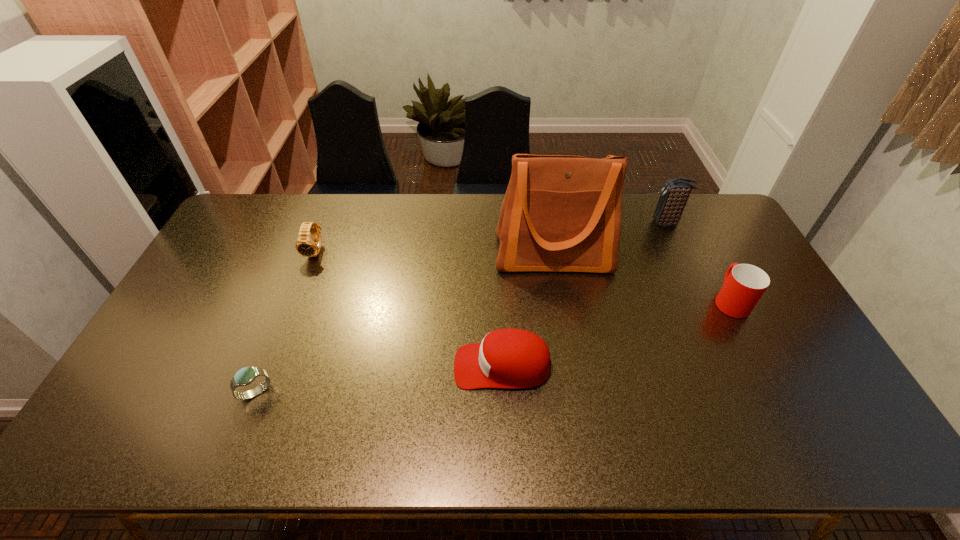
The image size is (960, 540). In order to click on shopping bag located in the far edge section of the desktop in this screenshot , I will do `click(560, 213)`.

Where is `clutch bag situated at the far edge`? The width and height of the screenshot is (960, 540). clutch bag situated at the far edge is located at coordinates (674, 195).

Where is `object that is at the right edge`? Image resolution: width=960 pixels, height=540 pixels. object that is at the right edge is located at coordinates (744, 284).

This screenshot has height=540, width=960. In the image, there is a desktop. In order to click on vacant space at the far edge in this screenshot , I will do `click(396, 224)`.

The width and height of the screenshot is (960, 540). In the image, there is a desktop. Identify the location of vacant space at the near edge. (282, 448).

In the image, there is a desktop. At what (x,y) coordinates should I click in order to perform the action: click on vacant area at the left edge. Please return your answer as a coordinate pair (x, y). The width and height of the screenshot is (960, 540). Looking at the image, I should click on (153, 373).

Locate an element on the screen. free region at the right edge of the desktop is located at coordinates (820, 394).

Locate an element on the screen. The width and height of the screenshot is (960, 540). free space between the baseball cap and the shopping bag is located at coordinates (528, 310).

Where is `free space between the cup and the shopping bag`? The height and width of the screenshot is (540, 960). free space between the cup and the shopping bag is located at coordinates (642, 278).

You are a GUI agent. You are given a task and a screenshot of the screen. Output one action in this format:
    pyautogui.click(x=<x>, y=<y>)
    Task: Click on the free space between the shorter watch and the tallest object
    The height and width of the screenshot is (540, 960).
    Given the screenshot: What is the action you would take?
    pyautogui.click(x=405, y=323)